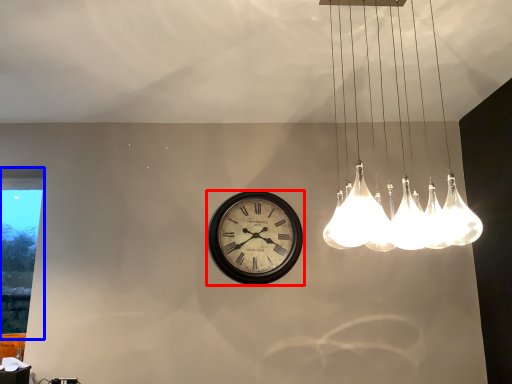
Question: Among these objects, which one is farthest to the camera, wall clock (highlighted by a red box) or window (highlighted by a blue box)?

Choices:
 (A) wall clock
 (B) window

Answer: (B)